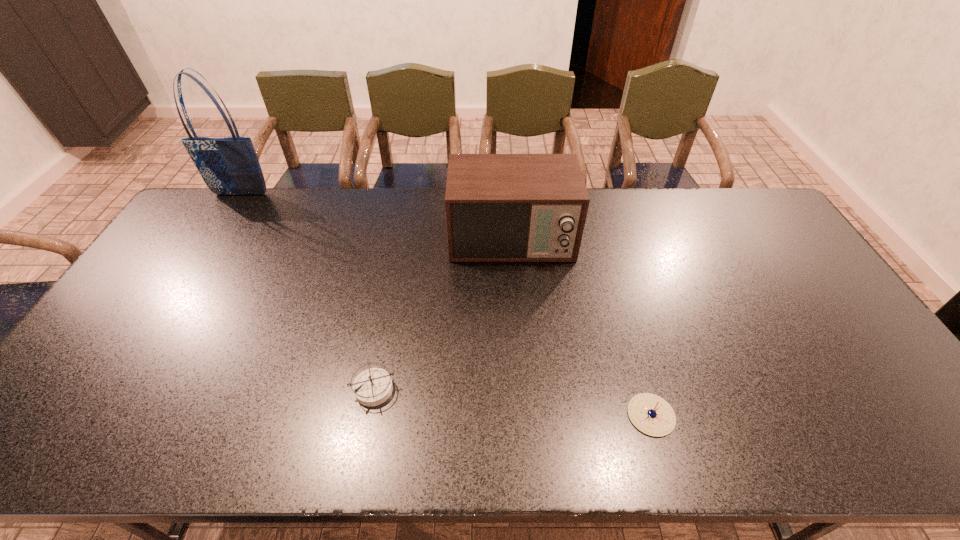
Locate an element on the screen. This screenshot has height=540, width=960. shopping bag that is at the far edge is located at coordinates (229, 166).

Locate an element on the screen. This screenshot has height=540, width=960. radio receiver positioned at the far edge is located at coordinates (499, 207).

The image size is (960, 540). I want to click on object that is positioned at the near edge, so click(x=652, y=415).

Locate an element on the screen. object situated at the left edge is located at coordinates (229, 166).

You are a GUI agent. You are given a task and a screenshot of the screen. Output one action in this format:
    pyautogui.click(x=<x>, y=<y>)
    Task: Click on the object that is at the far left corner
    Image resolution: width=960 pixels, height=540 pixels.
    Given the screenshot: What is the action you would take?
    click(229, 166)

The width and height of the screenshot is (960, 540). In the image, there is a desktop. What are the coordinates of `free space at the far edge` in the screenshot? It's located at (248, 212).

Find the location of `vacant space at the near edge of the desktop`. vacant space at the near edge of the desktop is located at coordinates (101, 450).

At what (x,y) coordinates should I click in order to perform the action: click on vacant space at the left edge of the desktop. Please return your answer as a coordinate pair (x, y). This screenshot has height=540, width=960. Looking at the image, I should click on (180, 298).

At what (x,y) coordinates should I click in order to perform the action: click on free point at the right edge. Please return your answer as a coordinate pair (x, y). The height and width of the screenshot is (540, 960). Looking at the image, I should click on (739, 238).

At what (x,y) coordinates should I click in order to perform the action: click on free point between the farthest object and the right compass. Please return your answer as a coordinate pair (x, y). Looking at the image, I should click on (446, 305).